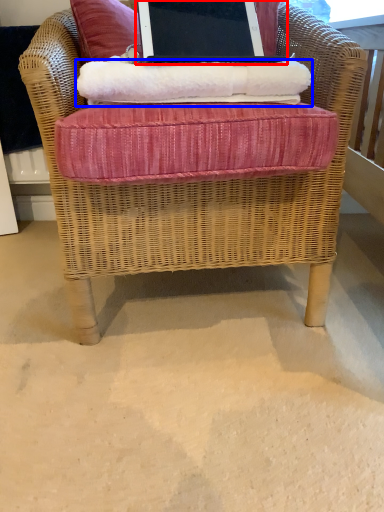
Question: Which of the following is the closest to the observer, laptop (highlighted by a red box) or material (highlighted by a blue box)?

Choices:
 (A) laptop
 (B) material

Answer: (A)